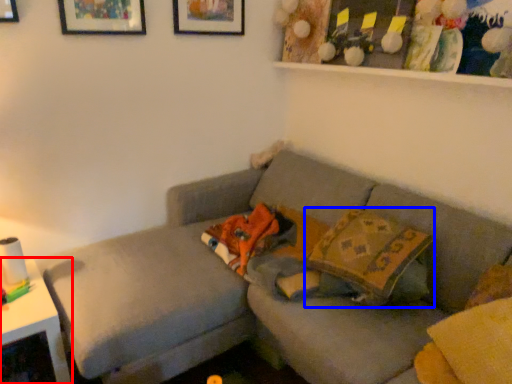
Question: Among these objects, which one is nearest to the camera, table (highlighted by a red box) or throw pillow (highlighted by a blue box)?

Choices:
 (A) table
 (B) throw pillow

Answer: (A)